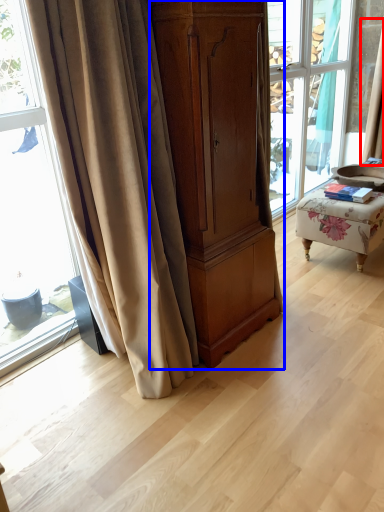
Question: Which object is closer to the camera taking this photo, curtain (highlighted by a red box) or cabinetry (highlighted by a blue box)?

Choices:
 (A) curtain
 (B) cabinetry

Answer: (B)